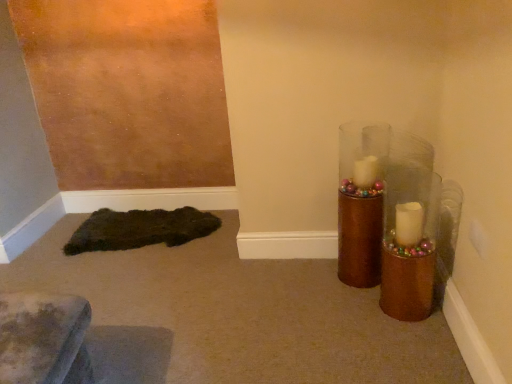
Question: From a real-world perspective, relative to gold metallic candle holder at right, is dark brown fuzzy rug at lower left vertically above or below?

Choices:
 (A) above
 (B) below

Answer: (B)

Question: Considering the relative positions of dark brown fuzzy rug at lower left and gold metallic candle holder at right in the image provided, is dark brown fuzzy rug at lower left to the left or to the right of gold metallic candle holder at right?

Choices:
 (A) left
 (B) right

Answer: (A)

Question: Considering the positions of point (122, 220) and point (365, 226), is point (122, 220) closer or farther from the camera than point (365, 226)?

Choices:
 (A) closer
 (B) farther

Answer: (B)

Question: In the image, is gold metallic candle holder at right on the left side or the right side of dark brown fuzzy rug at lower left?

Choices:
 (A) left
 (B) right

Answer: (B)

Question: From a real-world perspective, is gold metallic candle holder at right positioned above or below dark brown fuzzy rug at lower left?

Choices:
 (A) below
 (B) above

Answer: (B)

Question: From the image's perspective, is gold metallic candle holder at right positioned above or below dark brown fuzzy rug at lower left?

Choices:
 (A) above
 (B) below

Answer: (A)

Question: In terms of width, does gold metallic candle holder at right look wider or thinner when compared to dark brown fuzzy rug at lower left?

Choices:
 (A) wide
 (B) thin

Answer: (B)